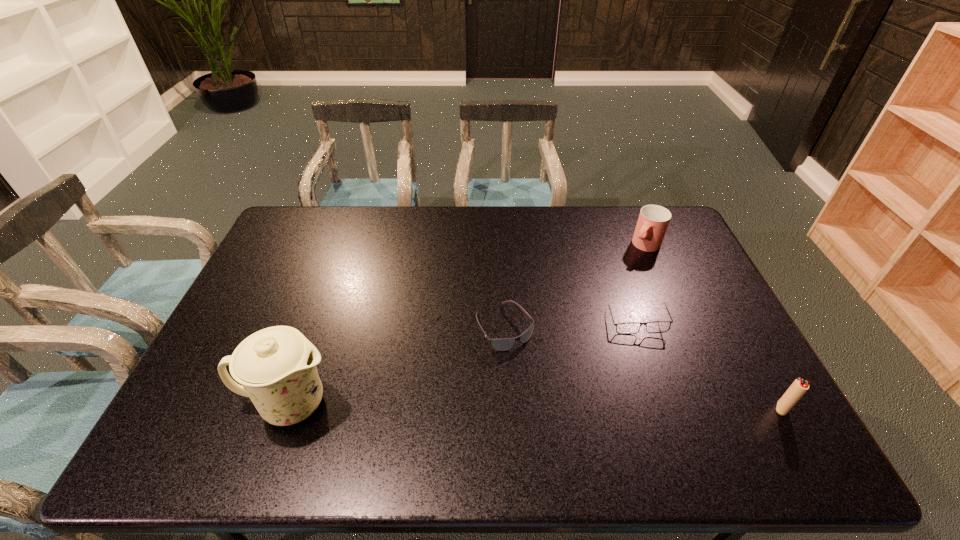
Where is `empty space between the cup and the spectacles`? The width and height of the screenshot is (960, 540). empty space between the cup and the spectacles is located at coordinates coord(641,284).

Select which object is the third closest to the chinaware. Please provide its 2D coordinates. Your answer should be formatted as a tuple, i.e. [(x, y)], where the tuple contains the x and y coordinates of a point satisfying the conditions above.

[(653, 220)]

You are a GUI agent. You are given a task and a screenshot of the screen. Output one action in this format:
    pyautogui.click(x=<x>, y=<y>)
    Task: Click on the fourth closest object relative to the sunglasses
    The image size is (960, 540).
    Given the screenshot: What is the action you would take?
    pyautogui.click(x=798, y=388)

What are the coordinates of `vacant space that satisfies the following two spatial constraints: 1. on the front side of the igniter; 2. on the right side of the second object from left to right` in the screenshot? It's located at (509, 409).